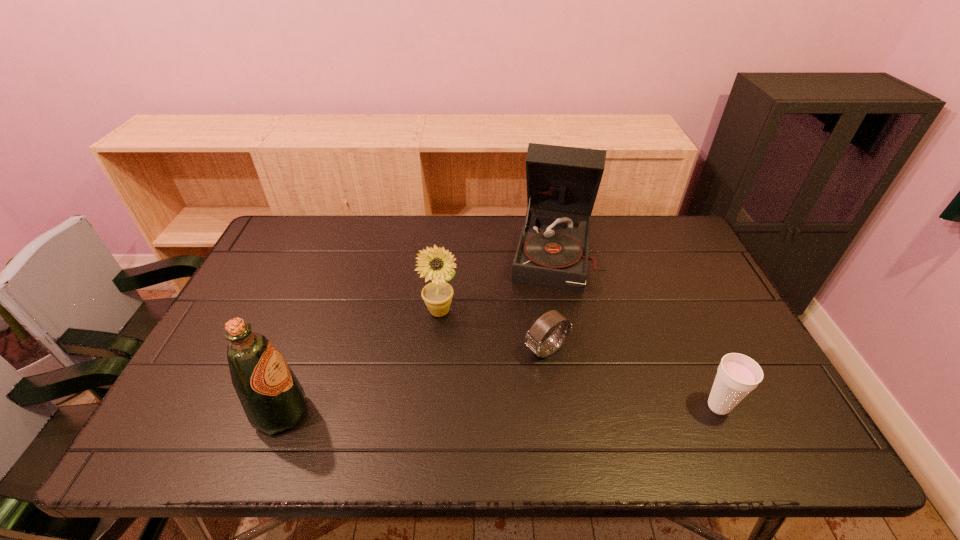
Locate an element on the screen. free space located 0.320m on the front-facing side of the olive oil is located at coordinates (448, 413).

You are a GUI agent. You are given a task and a screenshot of the screen. Output one action in this format:
    pyautogui.click(x=<x>, y=<y>)
    Task: Click on the vacant space located 0.240m on the left of the fourth tallest object
    The height and width of the screenshot is (540, 960).
    Given the screenshot: What is the action you would take?
    pyautogui.click(x=597, y=406)

Where is `free region located on the face of the fourth nearest object`? The height and width of the screenshot is (540, 960). free region located on the face of the fourth nearest object is located at coordinates (464, 334).

The image size is (960, 540). What are the coordinates of `vacant space located on the face of the fourth nearest object` in the screenshot? It's located at (464, 334).

This screenshot has height=540, width=960. In order to click on vacant space located 0.050m on the face of the fourth nearest object in this screenshot , I will do `click(462, 332)`.

You are a GUI agent. You are given a task and a screenshot of the screen. Output one action in this format:
    pyautogui.click(x=<x>, y=<y>)
    Task: Click on the vacant area situated on the face of the third farthest object
    The width and height of the screenshot is (960, 540).
    Given the screenshot: What is the action you would take?
    pyautogui.click(x=488, y=386)

The image size is (960, 540). Identify the location of blank area located 0.260m on the face of the third farthest object. (444, 414).

Where is `vacant point located 0.130m on the face of the third farthest object`? The image size is (960, 540). vacant point located 0.130m on the face of the third farthest object is located at coordinates (488, 386).

Find the location of a particular element. free space located 0.400m on the front-facing side of the tallest object is located at coordinates (532, 409).

Find the location of a particular element. The width and height of the screenshot is (960, 540). vacant region located on the front-facing side of the tallest object is located at coordinates (539, 368).